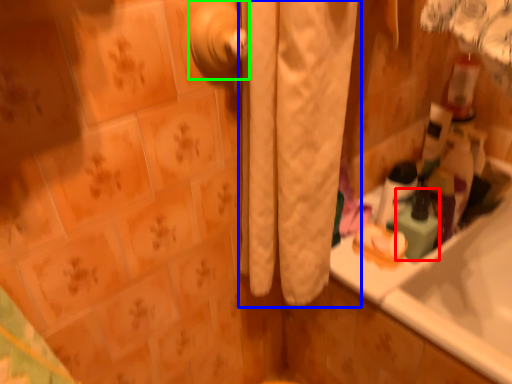
Question: Based on their relative distances, which object is nearer to cleaning product (highlighted by a red box)? Choose from curtain (highlighted by a blue box) and door handle (highlighted by a green box).

Choices:
 (A) curtain
 (B) door handle

Answer: (A)